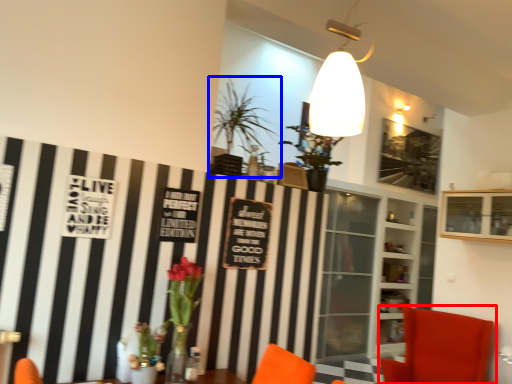
Question: Among these objects, which one is farthest to the camera, chair (highlighted by a red box) or houseplant (highlighted by a blue box)?

Choices:
 (A) chair
 (B) houseplant

Answer: (A)